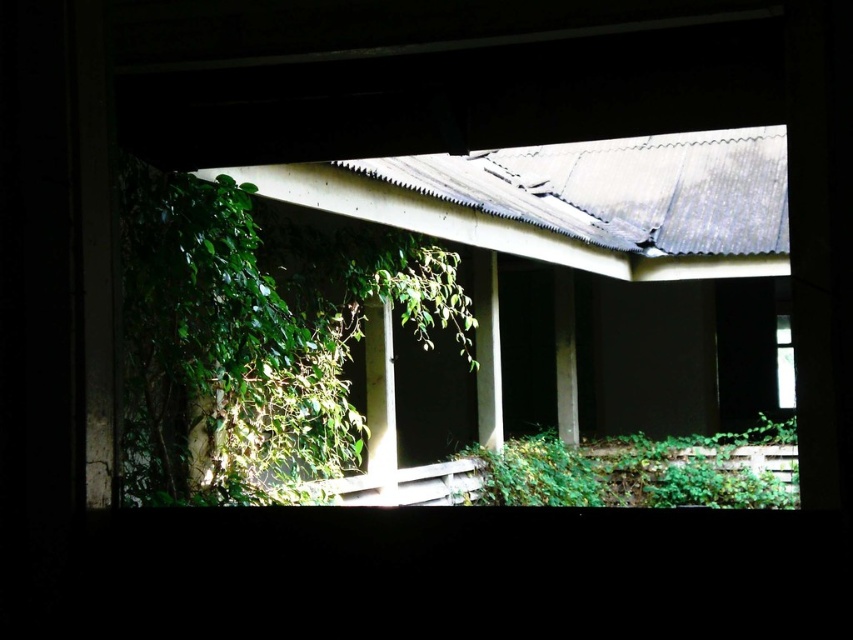
Between green leafy plant at left and green leafy plant at lower right, which one is positioned higher?

Positioned higher is green leafy plant at left.

Does green leafy plant at left come in front of green leafy plant at lower right?

That is True.

What do you see at coordinates (253, 339) in the screenshot?
I see `green leafy plant at left` at bounding box center [253, 339].

This screenshot has width=853, height=640. Find the location of `green leafy plant at left`. green leafy plant at left is located at coordinates (253, 339).